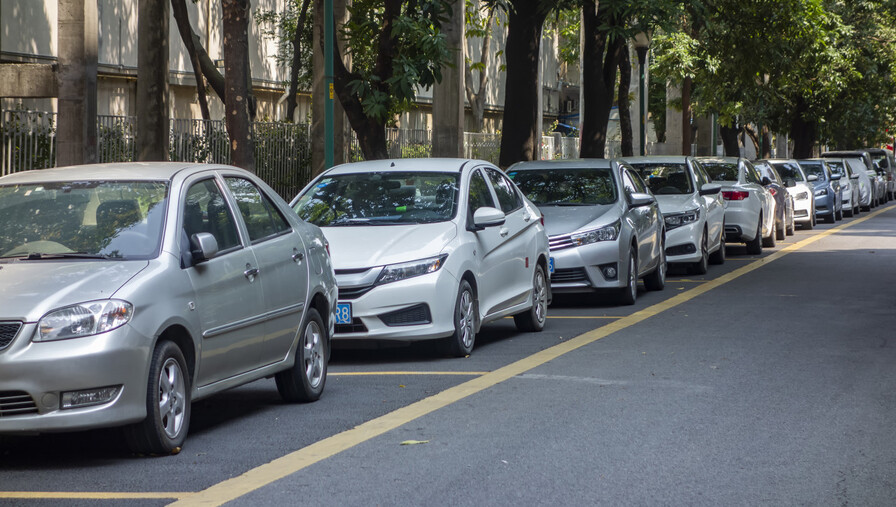
The height and width of the screenshot is (507, 896). What are the coordinates of `pillars` in the screenshot? It's located at (72, 117), (157, 96), (449, 94), (702, 134), (781, 146), (816, 152).